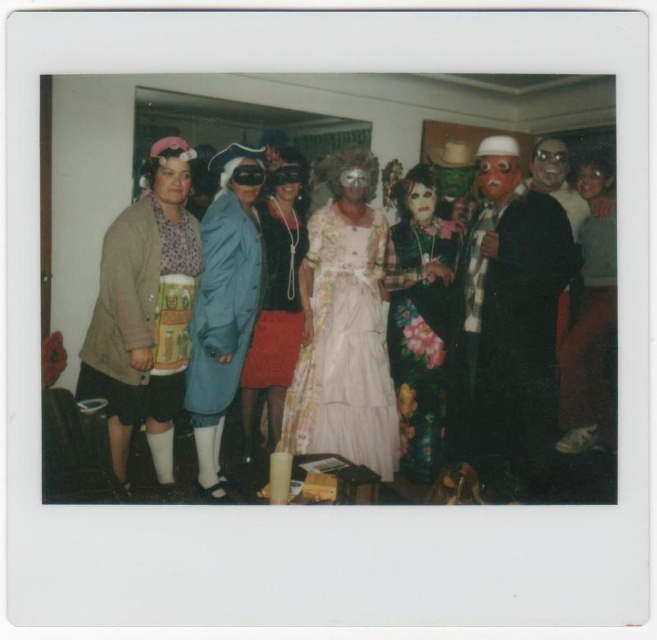
Based on the photo, between matte brown sweater at left and floral-patterned dress at center, which one appears on the right side from the viewer's perspective?

From the viewer's perspective, floral-patterned dress at center appears more on the right side.

Between matte brown sweater at left and floral-patterned dress at center, which one is positioned lower?

floral-patterned dress at center

The width and height of the screenshot is (657, 640). Find the location of `matte brown sweater at left`. matte brown sweater at left is located at coordinates (145, 310).

Identify the location of matte brown sweater at left. Image resolution: width=657 pixels, height=640 pixels. (145, 310).

Is floral lace dress at center to the left of floral-patterned dress at center from the viewer's perspective?

Indeed, floral lace dress at center is positioned on the left side of floral-patterned dress at center.

Does floral lace dress at center have a lesser height compared to floral-patterned dress at center?

Correct, floral lace dress at center is not as tall as floral-patterned dress at center.

What are the coordinates of `floral lace dress at center` in the screenshot? It's located at (344, 348).

Who is lower down, matte brown sweater at left or matte blue coat at center?

matte blue coat at center

Is point (183, 305) farther from viewer compared to point (250, 272)?

That is False.

Is point (150, 371) closer to camera compared to point (254, 212)?

That is True.

Where is `matte brown sweater at left`? The image size is (657, 640). matte brown sweater at left is located at coordinates (145, 310).